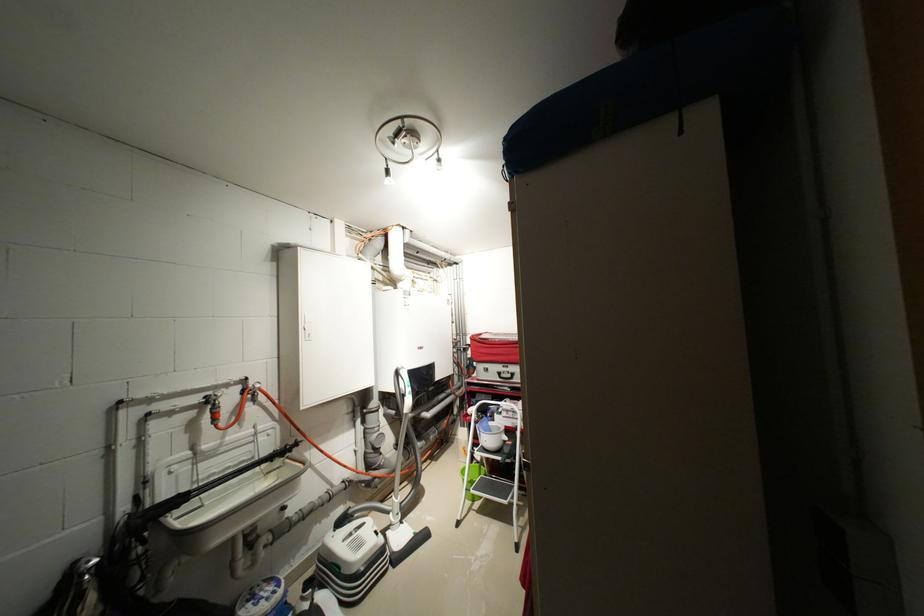
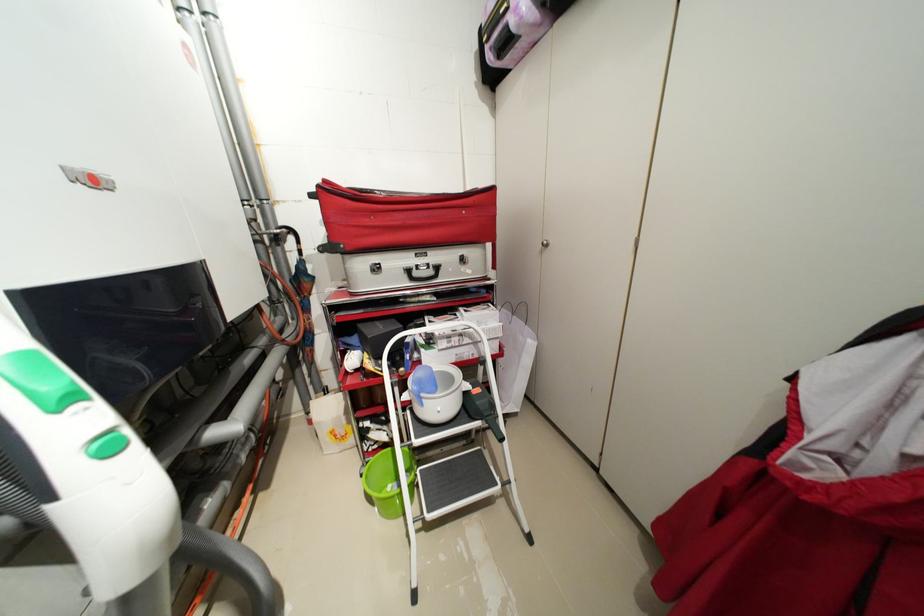
The point at (480, 336) is marked in the first image. Where is the corresponding point in the second image?

(332, 182)